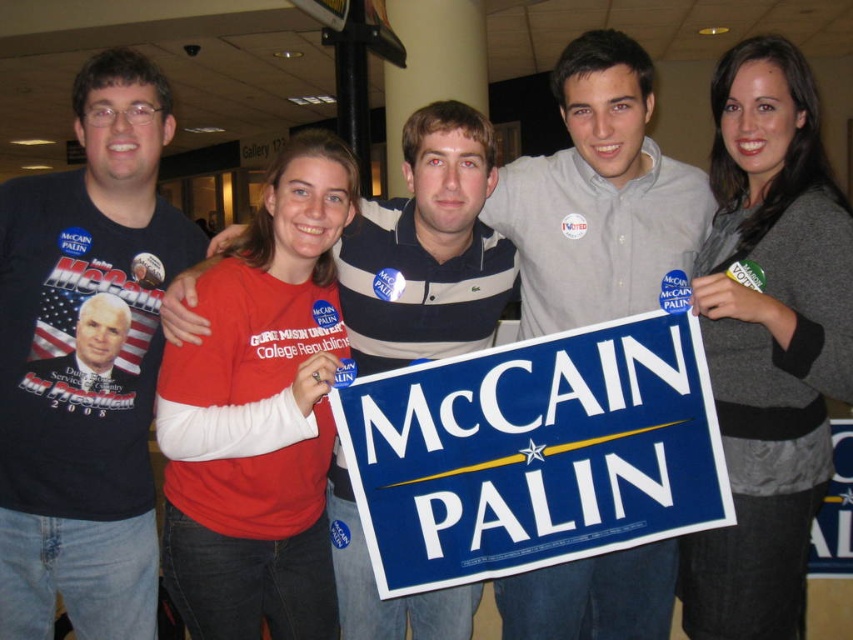
Question: Considering the real-world distances, which object is closest to the matte black t-shirt at left?

Choices:
 (A) gray sweater at upper right
 (B) blue plastic sign at center

Answer: (B)

Question: Does blue plastic sign at center appear on the left side of gray sweater at upper right?

Choices:
 (A) yes
 (B) no

Answer: (A)

Question: Which of the following is the closest to the observer?

Choices:
 (A) gray sweater at upper right
 (B) blue plastic sign at center
 (C) red cotton shirt at center
 (D) matte black t-shirt at left

Answer: (C)

Question: Does blue plastic sign at center come in front of red cotton shirt at center?

Choices:
 (A) no
 (B) yes

Answer: (A)

Question: Which point appears farthest from the camera in this image?

Choices:
 (A) (454, 385)
 (B) (242, 624)
 (C) (815, 436)
 (D) (33, 243)

Answer: (B)

Question: Does blue plastic sign at center have a greater width compared to gray sweater at upper right?

Choices:
 (A) no
 (B) yes

Answer: (B)